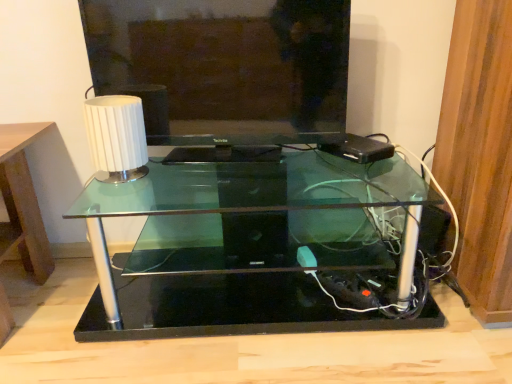
Question: Is transparent glass table at center inside or outside of matte black television at center?

Choices:
 (A) outside
 (B) inside

Answer: (A)

Question: In the image, is transparent glass table at center positioned in front of or behind matte black television at center?

Choices:
 (A) behind
 (B) front

Answer: (B)

Question: Which of these objects is positioned closest to the matte black television at center?

Choices:
 (A) transparent glass table at center
 (B) white ribbed lampshade at upper left

Answer: (B)

Question: Considering the real-world distances, which object is farthest from the matte black television at center?

Choices:
 (A) transparent glass table at center
 (B) white ribbed lampshade at upper left

Answer: (A)